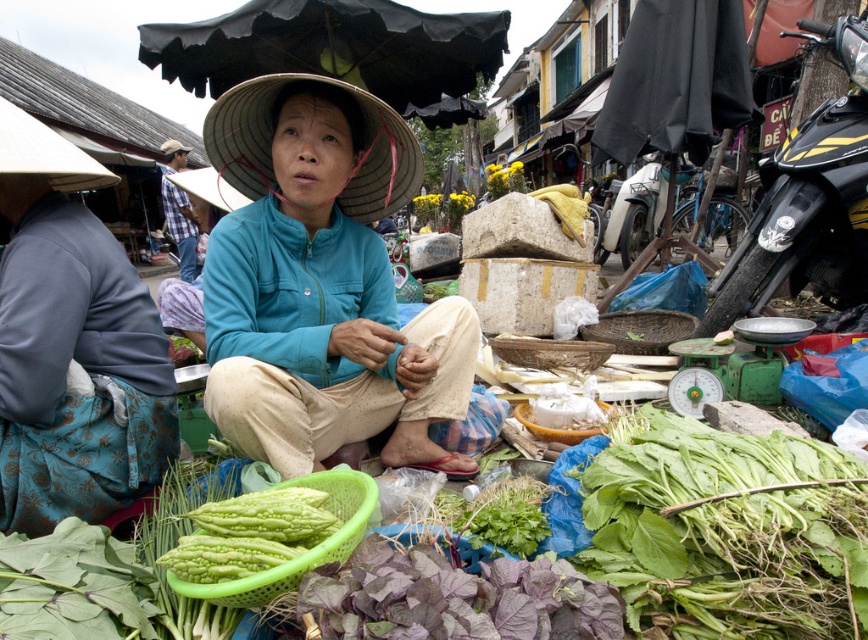
Question: Considering the real-world distances, which object is closest to the woven straw hat at center?

Choices:
 (A) black fabric umbrella at upper center
 (B) blue plaid shirt at upper left

Answer: (A)

Question: Can you confirm if green leafy at center is smaller than blue plaid shirt at upper left?

Choices:
 (A) no
 (B) yes

Answer: (A)

Question: Can you confirm if woven straw hat at center is wider than brown woven hat at center?

Choices:
 (A) yes
 (B) no

Answer: (B)

Question: Which point is farther to the camera?

Choices:
 (A) (403, 124)
 (B) (304, 509)

Answer: (A)

Question: Does green leafy at center appear under green matte vegetable at lower left?

Choices:
 (A) no
 (B) yes

Answer: (B)

Question: Which point is farther from the camera taking this photo?

Choices:
 (A) (215, 544)
 (B) (165, 150)
 (C) (343, 88)
 (D) (181, 253)

Answer: (B)